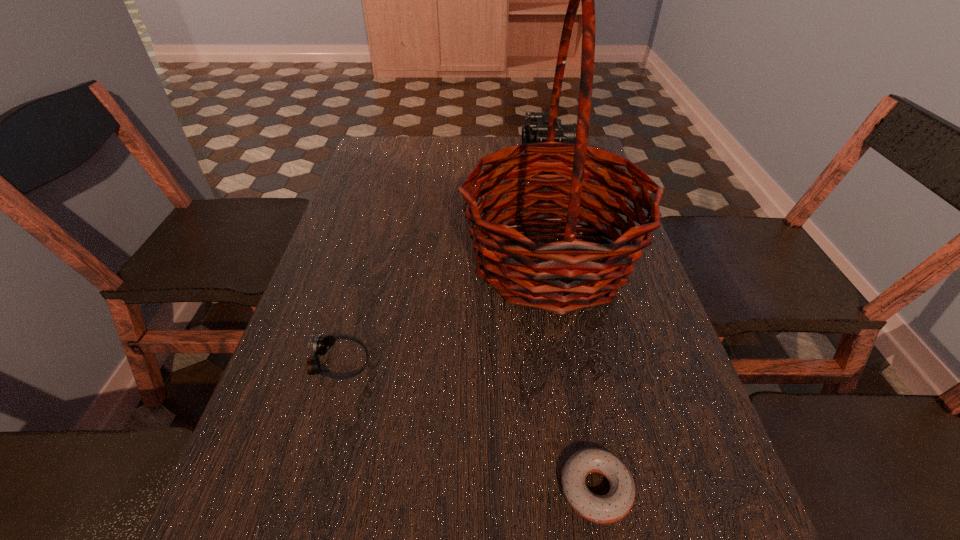
You are a GUI agent. You are given a task and a screenshot of the screen. Output one action in this format:
    pyautogui.click(x=<x>, y=<y>)
    Task: Click on the third nearest object
    The height and width of the screenshot is (540, 960).
    Given the screenshot: What is the action you would take?
    pyautogui.click(x=546, y=276)

Locate an element on the screen. The image size is (960, 540). the tallest object is located at coordinates (546, 276).

This screenshot has width=960, height=540. I want to click on binoculars, so click(x=536, y=131).

In order to click on the second tallest object in this screenshot , I will do point(536,131).

Where is `goggles`? The width and height of the screenshot is (960, 540). goggles is located at coordinates (321, 345).

I want to click on the leftmost object, so click(x=321, y=345).

Find the location of `the nearest object`. the nearest object is located at coordinates (617, 503).

You are a GUI agent. You are given a task and a screenshot of the screen. Output one action in this format:
    pyautogui.click(x=<x>, y=<y>)
    Task: Click on the vacant point located on the handle side of the basket
    The width and height of the screenshot is (960, 540).
    Given the screenshot: What is the action you would take?
    pyautogui.click(x=372, y=260)

Identify the location of vacant region located on the handle side of the basket. This screenshot has width=960, height=540. (369, 260).

Locate an element on the screen. The width and height of the screenshot is (960, 540). free space located 0.300m on the handle side of the basket is located at coordinates (335, 260).